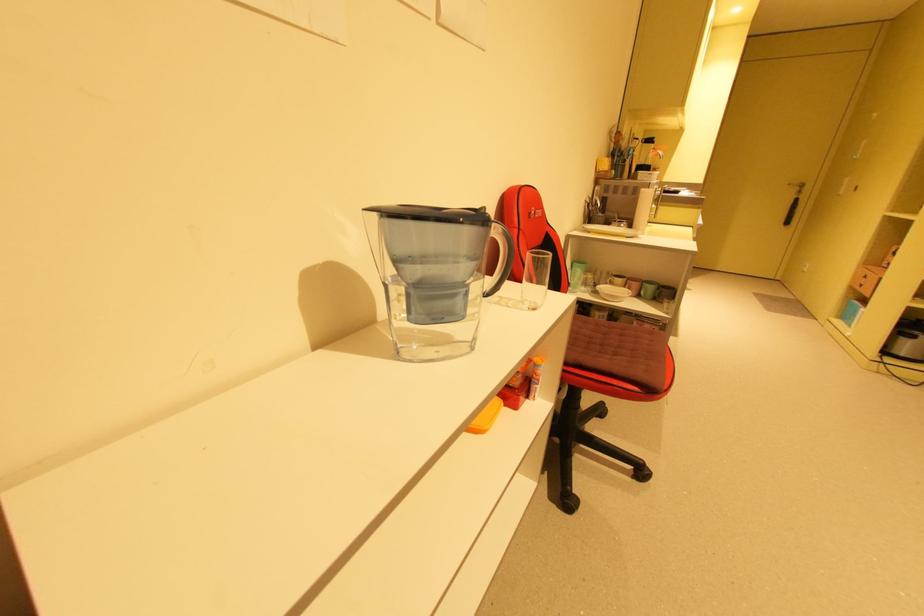
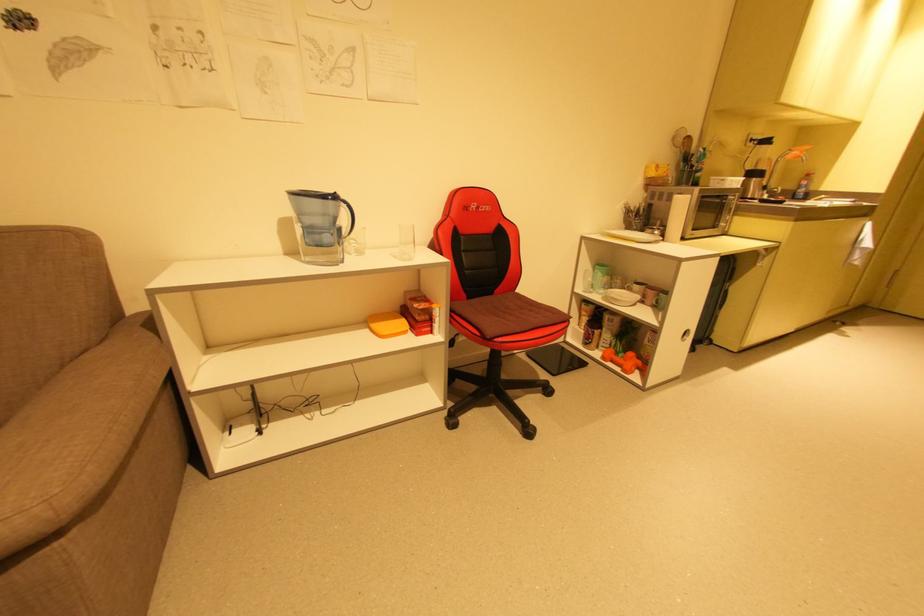
Where in the second image is the point corresponding to pixel 514 307 from the first image?

(400, 257)